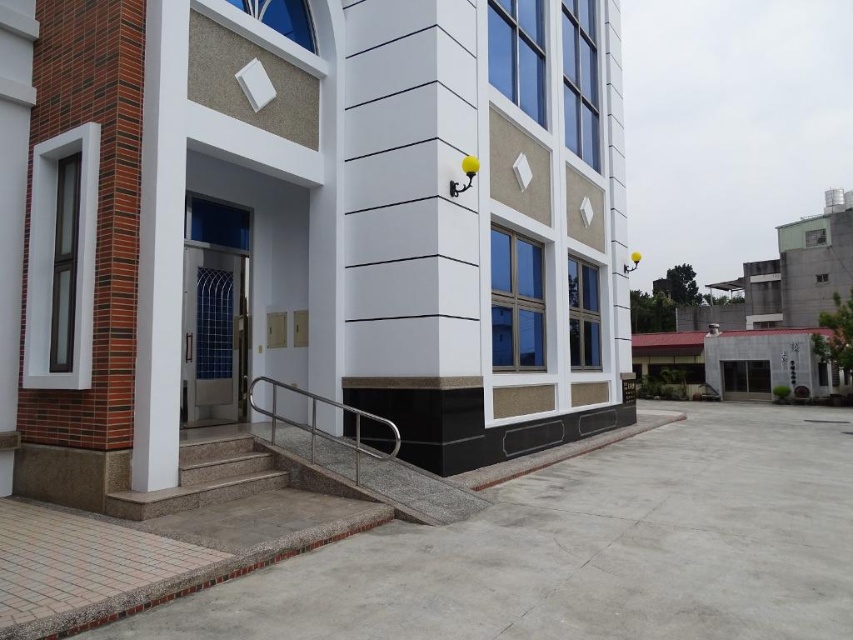
You are a delivery person trying to navigate to the entrance of the building. You see the granite steps at lower left and the satin silver railing at lower center. Which path is wider for your delivery cart?

The granite steps at lower left is wider than the satin silver railing at lower center, so the path on the granite steps at lower left is wider and suitable for the delivery cart.